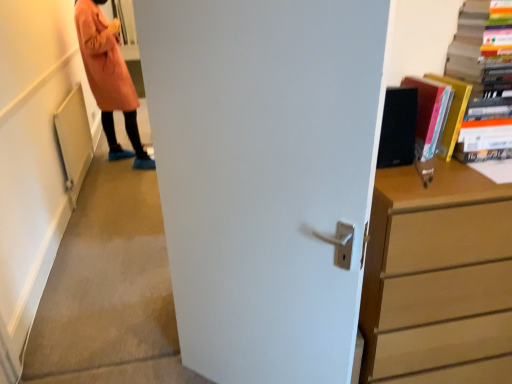
Question: From the image's perspective, is wooden chest of drawers at right above matte black book at upper right, which is counted as the first book, starting from the left?

Choices:
 (A) yes
 (B) no

Answer: (B)

Question: Does wooden chest of drawers at right have a lesser width compared to matte black book at upper right, which is counted as the first book, starting from the left?

Choices:
 (A) no
 (B) yes

Answer: (A)

Question: Is wooden chest of drawers at right positioned behind matte black book at upper right, placed as the second book when sorted from right to left?

Choices:
 (A) yes
 (B) no

Answer: (B)

Question: Does wooden chest of drawers at right turn towards matte black book at upper right, placed as the second book when sorted from right to left?

Choices:
 (A) yes
 (B) no

Answer: (B)

Question: Can you confirm if wooden chest of drawers at right is wider than matte black book at upper right, which is counted as the first book, starting from the left?

Choices:
 (A) no
 (B) yes

Answer: (B)

Question: From the image's perspective, is wooden chest of drawers at right below matte black book at upper right, placed as the second book when sorted from right to left?

Choices:
 (A) no
 (B) yes

Answer: (B)

Question: Is white matte door at center aimed at matte black book at upper right, which is counted as the first book, starting from the left?

Choices:
 (A) yes
 (B) no

Answer: (B)

Question: Is white matte door at center far from matte black book at upper right, placed as the second book when sorted from right to left?

Choices:
 (A) no
 (B) yes

Answer: (A)

Question: Can you confirm if white matte door at center is shorter than matte black book at upper right, which is counted as the first book, starting from the left?

Choices:
 (A) no
 (B) yes

Answer: (A)

Question: From a real-world perspective, does white matte door at center sit lower than matte black book at upper right, placed as the second book when sorted from right to left?

Choices:
 (A) no
 (B) yes

Answer: (B)

Question: Can you confirm if white matte door at center is positioned to the right of matte black book at upper right, placed as the second book when sorted from right to left?

Choices:
 (A) no
 (B) yes

Answer: (A)

Question: Is white matte door at center behind matte black book at upper right, placed as the second book when sorted from right to left?

Choices:
 (A) no
 (B) yes

Answer: (A)

Question: From a real-world perspective, does hardcover book at upper right, which appears as the 1th book when viewed from the right, sit lower than matte black book at upper right, placed as the second book when sorted from right to left?

Choices:
 (A) yes
 (B) no

Answer: (B)